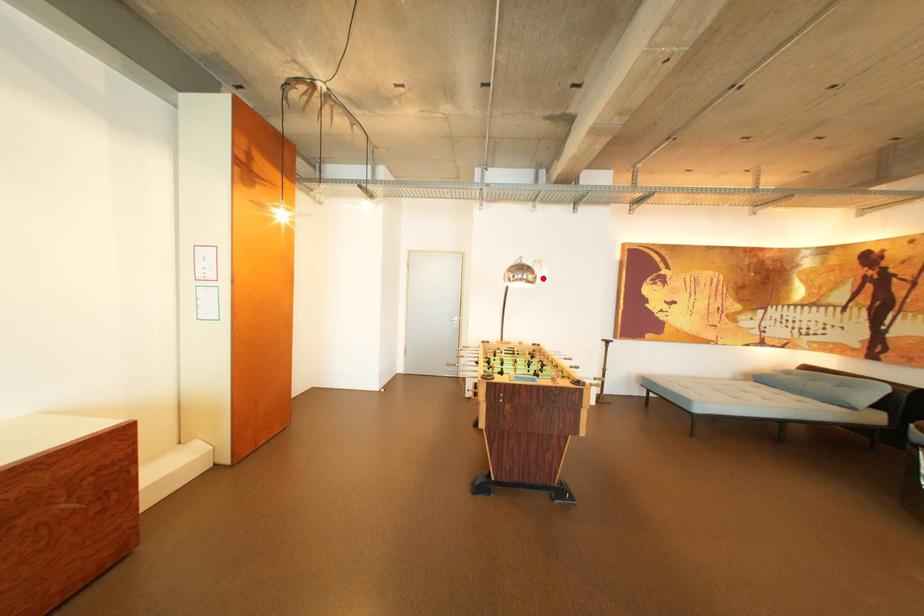
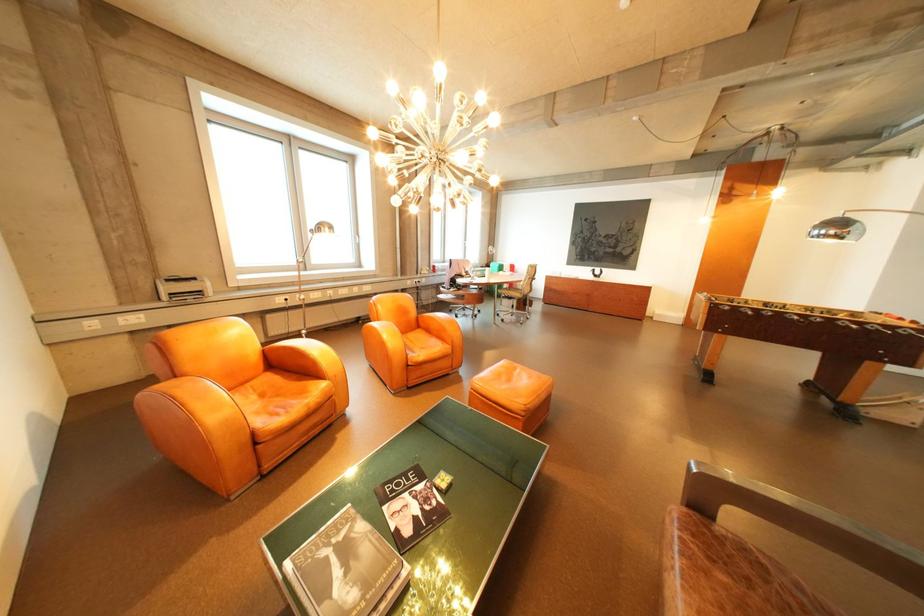
The point at the highlighted location is marked in the first image. Where is the corresponding point in the second image?

(846, 233)